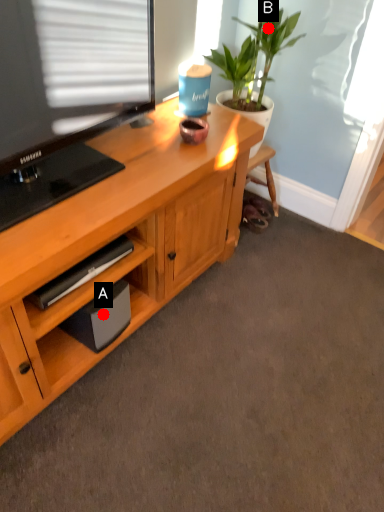
Question: Two points are circled on the image, labeled by A and B beside each circle. Which point is closer to the camera?

Choices:
 (A) A is closer
 (B) B is closer

Answer: (A)